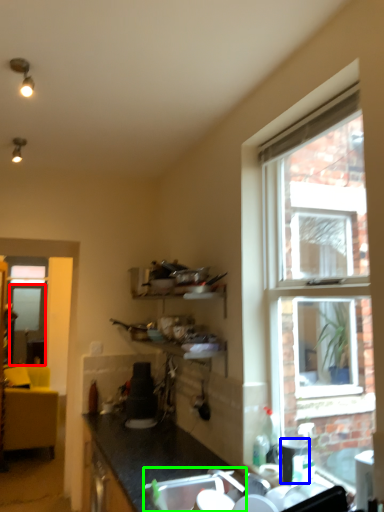
Question: Considering the real-world distances, which object is closest to screen door (highlighted by a red box)? appliance (highlighted by a blue box) or sink (highlighted by a green box).

Choices:
 (A) appliance
 (B) sink

Answer: (B)